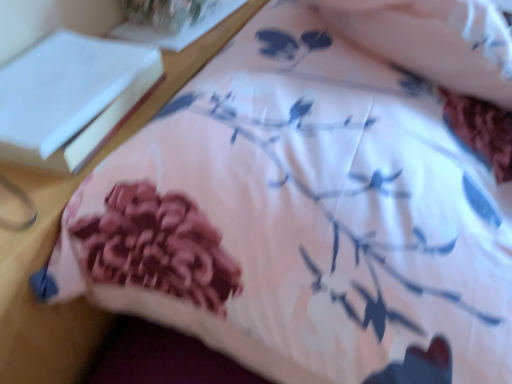
Where is `empty space that is ontop of white paper at upper left, the 2th book positioned from the back (from a real-world perspective)`? empty space that is ontop of white paper at upper left, the 2th book positioned from the back (from a real-world perspective) is located at coordinates (54, 74).